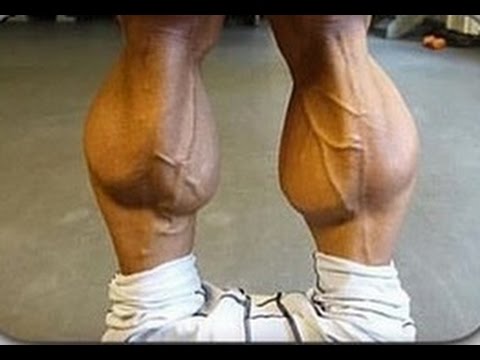
Where is `floor`? floor is located at coordinates (257, 144).